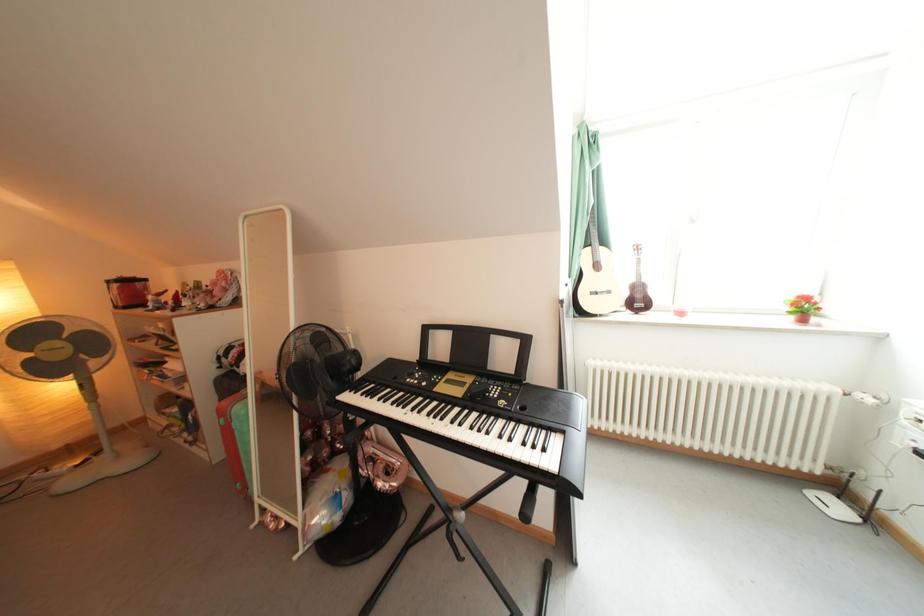
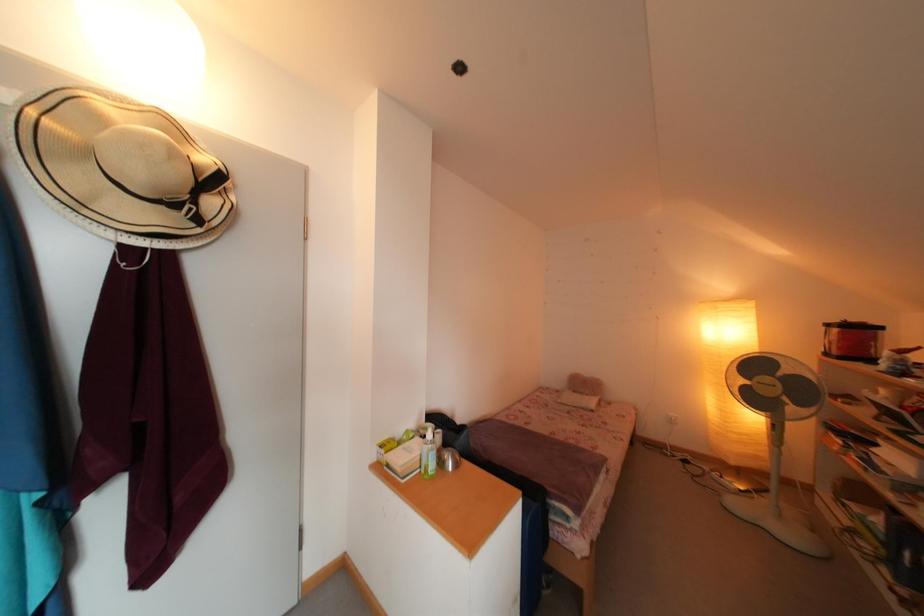
Question: The camera is either moving clockwise (left) or counter-clockwise (right) around the object. The first image is from the beginning of the video and the second image is from the end. Is the camera moving left or right when shooting the video?

Choices:
 (A) Left
 (B) Right

Answer: (B)